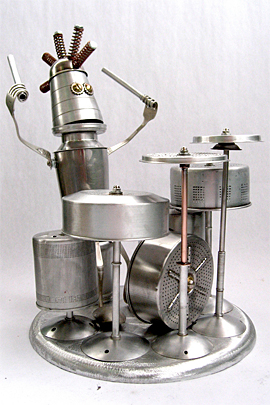
This screenshot has height=405, width=270. I want to click on wall, so click(23, 201).